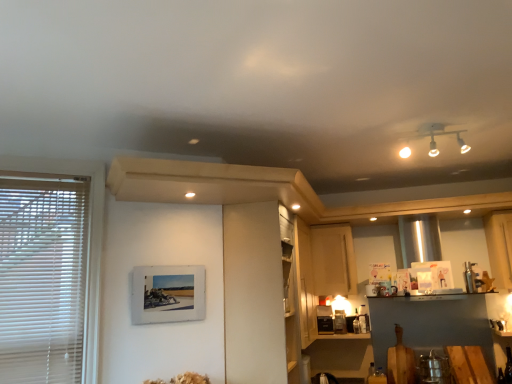
Question: Is white blinds at left wider than white matte cabinet at center, marked as the 1th cabinetry in a left-to-right arrangement?

Choices:
 (A) no
 (B) yes

Answer: (A)

Question: Considering the relative positions of white blinds at left and white matte cabinet at center, marked as the 1th cabinetry in a left-to-right arrangement, in the image provided, is white blinds at left to the left of white matte cabinet at center, marked as the 1th cabinetry in a left-to-right arrangement, from the viewer's perspective?

Choices:
 (A) yes
 (B) no

Answer: (A)

Question: Is white blinds at left to the right of white matte cabinet at center, which is the 2th cabinetry from right to left, from the viewer's perspective?

Choices:
 (A) yes
 (B) no

Answer: (B)

Question: Is white blinds at left far away from white matte cabinet at center, which appears as the second cabinetry when viewed from the back?

Choices:
 (A) yes
 (B) no

Answer: (B)

Question: Does white blinds at left have a smaller size compared to white matte cabinet at center, the first cabinetry when ordered from front to back?

Choices:
 (A) yes
 (B) no

Answer: (A)

Question: In terms of width, does wooden picture frame at lower left look wider or thinner when compared to white matte cabinet at center, marked as the 1th cabinetry in a left-to-right arrangement?

Choices:
 (A) wide
 (B) thin

Answer: (B)

Question: Is point (158, 319) closer or farther from the camera than point (261, 344)?

Choices:
 (A) closer
 (B) farther

Answer: (A)

Question: From the image's perspective, relative to white matte cabinet at center, marked as the 1th cabinetry in a left-to-right arrangement, is wooden picture frame at lower left above or below?

Choices:
 (A) below
 (B) above

Answer: (B)

Question: Based on their sizes in the image, would you say wooden picture frame at lower left is bigger or smaller than white matte cabinet at center, the first cabinetry when ordered from front to back?

Choices:
 (A) big
 (B) small

Answer: (B)

Question: Based on their positions, is satin black toaster at lower center located to the left or right of white blinds at left?

Choices:
 (A) right
 (B) left

Answer: (A)

Question: Does point (324, 306) appear closer or farther from the camera than point (87, 357)?

Choices:
 (A) farther
 (B) closer

Answer: (A)

Question: Do you think satin black toaster at lower center is within white blinds at left, or outside of it?

Choices:
 (A) inside
 (B) outside

Answer: (B)

Question: From the image's perspective, is satin black toaster at lower center located above or below white blinds at left?

Choices:
 (A) below
 (B) above

Answer: (A)

Question: From the image's perspective, is white matte cabinet at center, the first cabinetry when ordered from front to back, located above or below satin black toaster at lower center?

Choices:
 (A) above
 (B) below

Answer: (A)

Question: Considering the positions of white matte cabinet at center, which appears as the second cabinetry when viewed from the back, and satin black toaster at lower center in the image, is white matte cabinet at center, which appears as the second cabinetry when viewed from the back, wider or thinner than satin black toaster at lower center?

Choices:
 (A) thin
 (B) wide

Answer: (B)